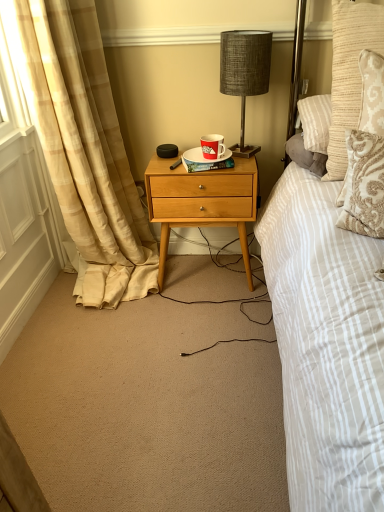
Question: Is natural wood nightstand at center positioned behind beige plaid curtain at left?

Choices:
 (A) yes
 (B) no

Answer: (A)

Question: Can you confirm if natural wood nightstand at center is shorter than beige plaid curtain at left?

Choices:
 (A) no
 (B) yes

Answer: (B)

Question: From a real-world perspective, is natural wood nightstand at center under beige plaid curtain at left?

Choices:
 (A) no
 (B) yes

Answer: (B)

Question: Does natural wood nightstand at center come in front of beige plaid curtain at left?

Choices:
 (A) yes
 (B) no

Answer: (B)

Question: Does natural wood nightstand at center turn towards beige plaid curtain at left?

Choices:
 (A) no
 (B) yes

Answer: (B)

Question: Is natural wood nightstand at center oriented away from beige plaid curtain at left?

Choices:
 (A) yes
 (B) no

Answer: (B)

Question: Is red paper cup at center behind natural wood nightstand at center?

Choices:
 (A) yes
 (B) no

Answer: (B)

Question: Does red paper cup at center have a smaller size compared to natural wood nightstand at center?

Choices:
 (A) yes
 (B) no

Answer: (A)

Question: Is red paper cup at center thinner than natural wood nightstand at center?

Choices:
 (A) yes
 (B) no

Answer: (A)

Question: Can you confirm if red paper cup at center is shorter than natural wood nightstand at center?

Choices:
 (A) yes
 (B) no

Answer: (A)

Question: Could you tell me if red paper cup at center is turned towards natural wood nightstand at center?

Choices:
 (A) no
 (B) yes

Answer: (A)

Question: Is red paper cup at center taller than natural wood nightstand at center?

Choices:
 (A) yes
 (B) no

Answer: (B)

Question: From the image's perspective, is hardcover book at center located above white glossy plate at center?

Choices:
 (A) yes
 (B) no

Answer: (B)